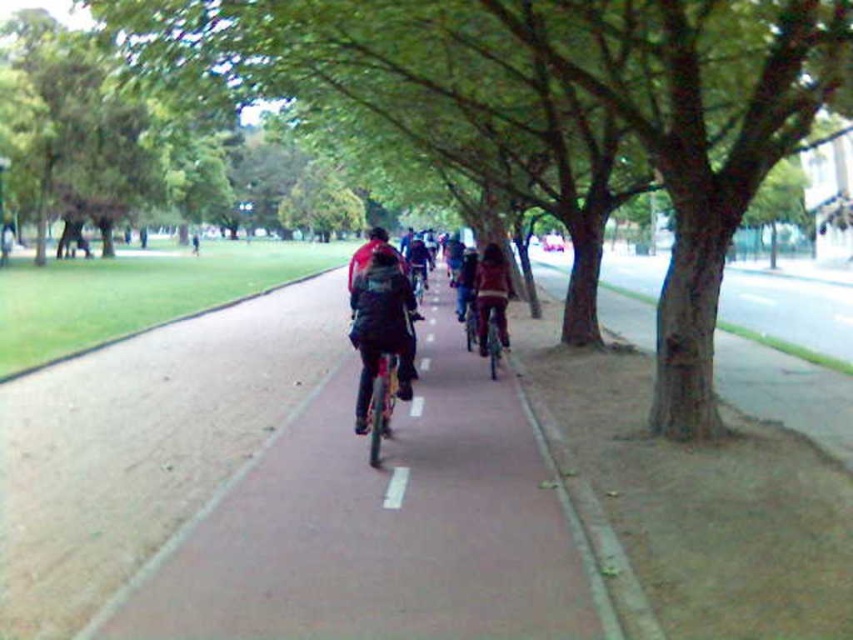
Question: Among these objects, which one is farthest from the camera?

Choices:
 (A) green leafy tree at center
 (B) dark blue jacket at center
 (C) metallic silver bicycle at center

Answer: (C)

Question: In this image, where is dark blue jacket at center located relative to matte black jacket at center?

Choices:
 (A) right
 (B) left

Answer: (B)

Question: Which object appears closest to the camera in this image?

Choices:
 (A) dark blue jacket at center
 (B) matte black jacket at center
 (C) white matte line at center

Answer: (C)

Question: Does green leafy tree at center come in front of matte black jacket at center?

Choices:
 (A) no
 (B) yes

Answer: (B)

Question: Based on their relative distances, which object is nearer to the metallic silver bicycle at center?

Choices:
 (A) white matte line at center
 (B) matte black jacket at center
 (C) dark blue jacket at center

Answer: (B)

Question: Does green leafy tree at center come in front of dark blue jacket at center?

Choices:
 (A) yes
 (B) no

Answer: (A)